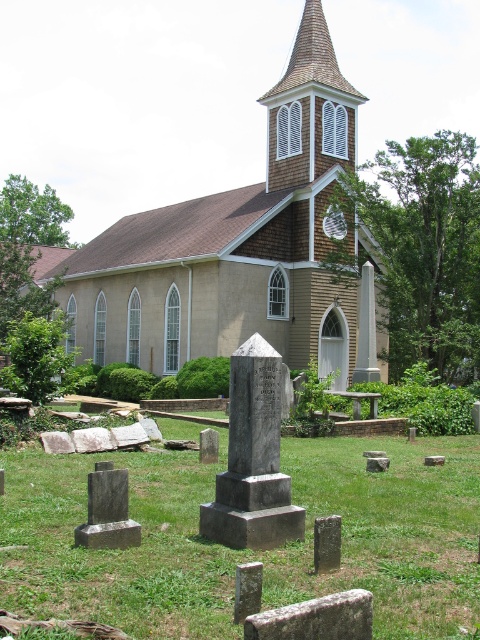
You are standing at the point with coordinates point (x=12, y=449) and want to walk towards the church in the background. Will you pass by point (x=358, y=291) along the way?

Since point (x=12, y=449) is in front of point (x=358, y=291), walking towards the church would require moving away from point (x=358, y=291). Therefore, you will not pass by point (x=358, y=291) along the way.

You are standing in the cemetery and want to walk towards the beige stucco church at center. Which direction should you walk to avoid stepping on the green grass at center?

You should walk towards the beige stucco church at center while moving to the side, as the green grass at center is located below the church, meaning it is directly in front of the church. Walking to the side would allow you to bypass the grass area.